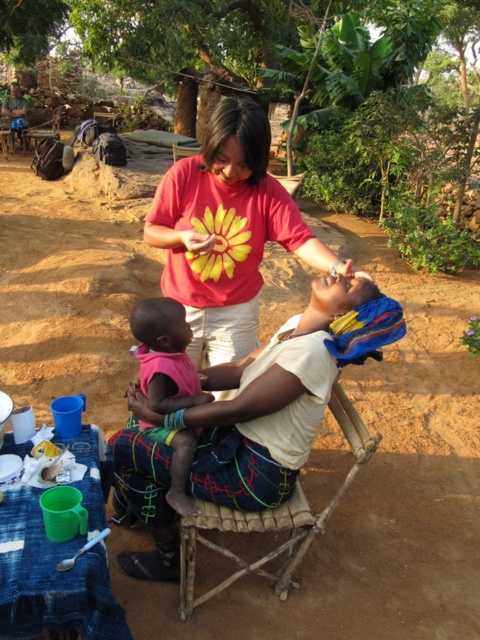
Question: Which object is the closest to the bamboo chair at center?

Choices:
 (A) floral t-shirt at center
 (B) pink fabric baby at center

Answer: (B)

Question: Is the position of floral t-shirt at center more distant than that of pink fabric baby at center?

Choices:
 (A) yes
 (B) no

Answer: (B)

Question: Does floral t-shirt at center have a greater width compared to bamboo chair at center?

Choices:
 (A) yes
 (B) no

Answer: (A)

Question: Estimate the real-world distances between objects in this image. Which object is farther from the floral t-shirt at center?

Choices:
 (A) pink fabric baby at center
 (B) bamboo chair at center

Answer: (B)

Question: Is floral t-shirt at center to the left of pink fabric baby at center from the viewer's perspective?

Choices:
 (A) no
 (B) yes

Answer: (A)

Question: Based on their relative distances, which object is farther from the floral t-shirt at center?

Choices:
 (A) pink fabric baby at center
 (B) bamboo chair at center

Answer: (B)